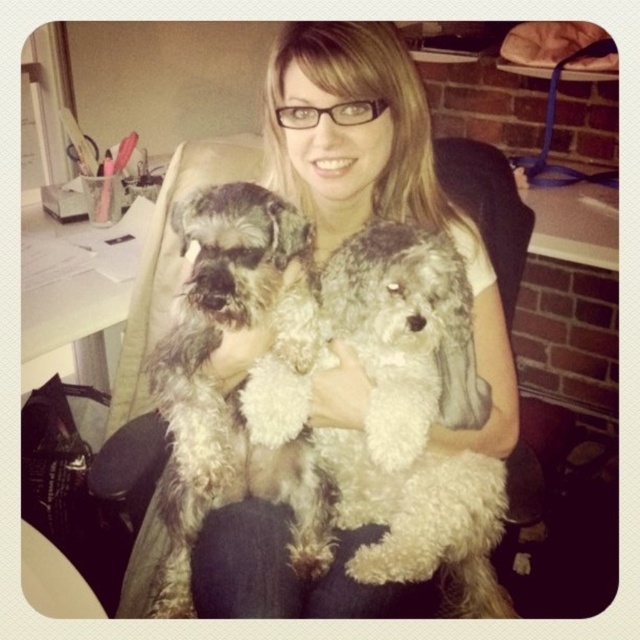
In the scene shown: Can you confirm if fuzzy white dog at center is bigger than fuzzy gray dog at center?

Yes.

Looking at this image, does fuzzy white dog at center come behind fuzzy gray dog at center?

Yes, it is behind fuzzy gray dog at center.

Who is more forward, (474, 576) or (236, 230)?

Point (236, 230)

This screenshot has width=640, height=640. Find the location of `fuzzy white dog at center`. fuzzy white dog at center is located at coordinates (416, 420).

Is smooth blonde hair at center bigger than fuzzy white dog at center?

Yes, smooth blonde hair at center is bigger than fuzzy white dog at center.

Can you confirm if smooth blonde hair at center is positioned above fuzzy white dog at center?

Indeed, smooth blonde hair at center is positioned over fuzzy white dog at center.

Which is in front, point (515, 433) or point (458, 269)?

Point (458, 269)

Find the location of a particular element. This screenshot has width=640, height=640. smooth blonde hair at center is located at coordinates (376, 172).

Which is more to the right, smooth blonde hair at center or fuzzy gray dog at center?

From the viewer's perspective, smooth blonde hair at center appears more on the right side.

Measure the distance between smooth blonde hair at center and fuzzy gray dog at center.

smooth blonde hair at center is 6.01 inches away from fuzzy gray dog at center.

Does point (401, 209) come in front of point (202, 412)?

No.

Where is `smooth blonde hair at center`? smooth blonde hair at center is located at coordinates (376, 172).